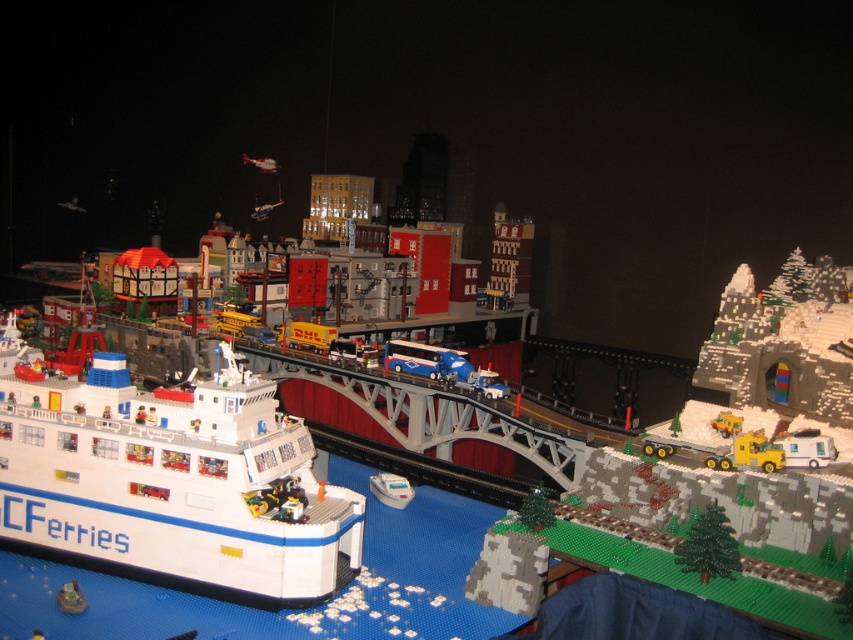
Question: Can you confirm if blue metallic bus at center is thinner than white plastic boat at lower center?

Choices:
 (A) yes
 (B) no

Answer: (B)

Question: Does yellow plastic truck at right have a lesser width compared to white plastic boat at lower center?

Choices:
 (A) no
 (B) yes

Answer: (B)

Question: Which point appears closest to the camera in this image?

Choices:
 (A) (294, 490)
 (B) (730, 435)
 (C) (370, 486)
 (D) (76, 588)

Answer: (D)

Question: Is white plastic ferry at lower left smaller than smooth plastic toy boat at lower left?

Choices:
 (A) yes
 (B) no

Answer: (B)

Question: Which of the following is the closest to the observer?

Choices:
 (A) smooth plastic toy boat at lower left
 (B) white plastic ferry at lower left

Answer: (A)

Question: Among these points, which one is farthest from the camera?

Choices:
 (A) (393, 488)
 (B) (57, 602)
 (C) (424, 349)

Answer: (C)